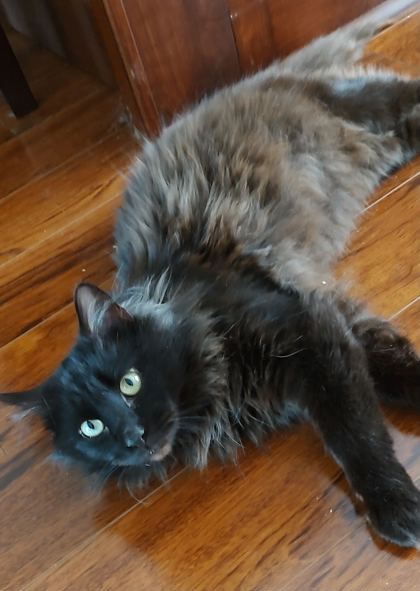
Identify the location of possible table leg. This screenshot has width=420, height=591. (17, 84).